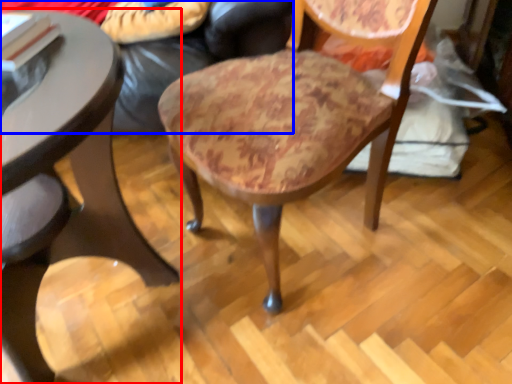
Question: Which object is closer to the camera taking this photo, table (highlighted by a red box) or couch (highlighted by a blue box)?

Choices:
 (A) table
 (B) couch

Answer: (A)